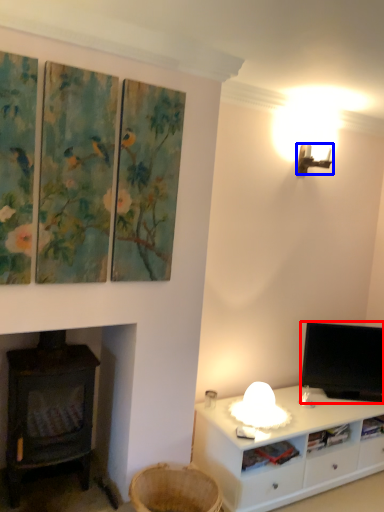
Question: Among these objects, which one is nearest to the camera, television (highlighted by a red box) or lamp (highlighted by a blue box)?

Choices:
 (A) television
 (B) lamp

Answer: (B)